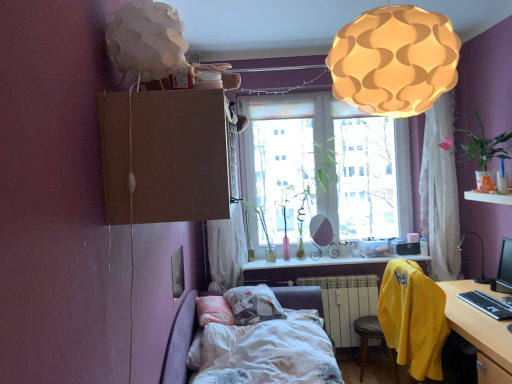
Image resolution: width=512 pixels, height=384 pixels. Describe the element at coordinates (481, 258) in the screenshot. I see `black plastic table lamp at right` at that location.

The image size is (512, 384). I want to click on translucent glass vase at window, the 4th plant from the front, so click(285, 217).

Locate an element on the screen. white sheer curtain at upper center, which is counted as the first curtain, starting from the left is located at coordinates (228, 229).

Describe the element at coordinates (146, 39) in the screenshot. I see `white paper lampshade at upper left, arranged as the 2th lamp when viewed from the right` at that location.

This screenshot has width=512, height=384. I want to click on translucent glass window at center, so click(x=326, y=167).

Image resolution: width=512 pixels, height=384 pixels. In order to click on black plastic table lamp at right in this screenshot , I will do `click(481, 258)`.

From a real-world perspective, is green glass vase at window, the 3th plant from the back, on top of black plastic keyboard at lower right?

Correct, in the physical world, green glass vase at window, the 3th plant from the back, is higher than black plastic keyboard at lower right.

Does green glass vase at window, arranged as the 2th plant when viewed from the front, turn towards black plastic keyboard at lower right?

No.

Measure the distance from green glass vase at window, arranged as the 2th plant when viewed from the front, to black plastic keyboard at lower right.

green glass vase at window, arranged as the 2th plant when viewed from the front, and black plastic keyboard at lower right are 1.35 meters apart from each other.

This screenshot has width=512, height=384. I want to click on desktop lying in front of the green glass vase at window, arranged as the 2th plant when viewed from the front, so click(487, 305).

Is point (362, 372) farther from camera compared to point (423, 167)?

That is False.

Is yellow fabric chair at lower right, acting as the 1th chair starting from the back, bigger or smaller than white sheer curtain at upper right, which appears as the 1th curtain when viewed from the right?

Clearly, yellow fabric chair at lower right, acting as the 1th chair starting from the back, is smaller in size than white sheer curtain at upper right, which appears as the 1th curtain when viewed from the right.

How many degrees apart are the facing directions of yellow fabric chair at lower right, acting as the 1th chair starting from the back, and white sheer curtain at upper right, which appears as the 1th curtain when viewed from the right?

They differ by 1.31 degrees in their facing directions.

Is yellow fabric chair at lower right, the 2th chair when ordered from top to bottom, in front of or behind white sheer curtain at upper right, positioned as the second curtain in left-to-right order, in the image?

yellow fabric chair at lower right, the 2th chair when ordered from top to bottom, is in front of white sheer curtain at upper right, positioned as the second curtain in left-to-right order.

Is green glass vase at window, which is the 2th plant from right to left, to the left or to the right of white sheer curtain at upper right, positioned as the second curtain in left-to-right order, in the image?

green glass vase at window, which is the 2th plant from right to left, is to the left of white sheer curtain at upper right, positioned as the second curtain in left-to-right order.

From a real-world perspective, does green glass vase at window, arranged as the 2th plant when viewed from the front, sit lower than white sheer curtain at upper right, positioned as the second curtain in left-to-right order?

Yes.

Based on the photo, from the image's perspective, is green glass vase at window, which is the 2th plant from right to left, beneath white sheer curtain at upper right, which appears as the 1th curtain when viewed from the right?

Correct, green glass vase at window, which is the 2th plant from right to left, appears lower than white sheer curtain at upper right, which appears as the 1th curtain when viewed from the right, in the image.

Is white sheer curtain at upper right, which appears as the 1th curtain when viewed from the right, a part of green glass vase at window, which is the 2th plant from right to left?

No, white sheer curtain at upper right, which appears as the 1th curtain when viewed from the right, is not a part of green glass vase at window, which is the 2th plant from right to left.

From a real-world perspective, is wooden desk at lower right positioned over white sheer curtain at upper right, positioned as the second curtain in left-to-right order, based on gravity?

Incorrect, from a real-world perspective, wooden desk at lower right is lower than white sheer curtain at upper right, positioned as the second curtain in left-to-right order.

Which point is more forward, (x=472, y=315) or (x=434, y=203)?

Point (x=472, y=315)

Which object is thinner, wooden desk at lower right or white sheer curtain at upper right, positioned as the second curtain in left-to-right order?

Thinner between the two is white sheer curtain at upper right, positioned as the second curtain in left-to-right order.

Would you say wooden desk at lower right is inside or outside white sheer curtain at upper right, which appears as the 1th curtain when viewed from the right?

wooden desk at lower right is outside white sheer curtain at upper right, which appears as the 1th curtain when viewed from the right.

Is white cotton bed at center aimed at black glossy monitor at right?

No, white cotton bed at center is not aimed at black glossy monitor at right.

From the image's perspective, which one is positioned lower, white cotton bed at center or black glossy monitor at right?

From the image's view, white cotton bed at center is below.

Considering the positions of point (280, 368) and point (498, 284), is point (280, 368) closer or farther from the camera than point (498, 284)?

Point (280, 368) is closer to the camera than point (498, 284).

From a real-world perspective, which object stands above the other?

matte white lampshade at upper center, which is the first lamp from back to front, from a real-world perspective.

Is yellow fabric chair at lower right, marked as the 1th chair in a bottom-to-top arrangement, positioned beyond the bounds of matte white lampshade at upper center, the 2th lamp from the front?

yellow fabric chair at lower right, marked as the 1th chair in a bottom-to-top arrangement, is positioned outside matte white lampshade at upper center, the 2th lamp from the front.

Considering the positions of objects yellow fabric chair at lower right, marked as the 1th chair in a bottom-to-top arrangement, and matte white lampshade at upper center, the 2th lamp from the front, in the image provided, who is more to the right, yellow fabric chair at lower right, marked as the 1th chair in a bottom-to-top arrangement, or matte white lampshade at upper center, the 2th lamp from the front,?

yellow fabric chair at lower right, marked as the 1th chair in a bottom-to-top arrangement, is more to the right.

Based on their sizes in the image, would you say yellow fabric chair at lower right, acting as the 1th chair starting from the back, is bigger or smaller than matte white lampshade at upper center, the 2th lamp from the front?

Clearly, yellow fabric chair at lower right, acting as the 1th chair starting from the back, is smaller in size than matte white lampshade at upper center, the 2th lamp from the front.

Who is more distant, white sheer curtain at upper center, which is counted as the first curtain, starting from the left, or translucent glass vase at window, the second plant when ordered from left to right?

Positioned behind is translucent glass vase at window, the second plant when ordered from left to right.

Which is correct: white sheer curtain at upper center, which is counted as the first curtain, starting from the left, is inside translucent glass vase at window, the second plant when ordered from left to right, or outside of it?

white sheer curtain at upper center, which is counted as the first curtain, starting from the left, is outside translucent glass vase at window, the second plant when ordered from left to right.

From the image's perspective, which one is positioned lower, white sheer curtain at upper center, which is counted as the first curtain, starting from the left, or translucent glass vase at window, marked as the first plant in a back-to-front arrangement?

translucent glass vase at window, marked as the first plant in a back-to-front arrangement, is shown below in the image.

Is white sheer curtain at upper center, the second curtain when ordered from right to left, oriented towards translucent glass vase at window, the second plant when ordered from left to right?

No, white sheer curtain at upper center, the second curtain when ordered from right to left, is not oriented towards translucent glass vase at window, the second plant when ordered from left to right.

At what (x,y) coordinates should I click in order to perform the action: click on desktop on the right of green glass vase at window, arranged as the 2th plant when viewed from the front. Please return your answer as a coordinate pair (x, y). The image size is (512, 384). Looking at the image, I should click on (487, 305).

You are a GUI agent. You are given a task and a screenshot of the screen. Output one action in this format:
    pyautogui.click(x=<x>, y=<y>)
    Task: Click on the chair that is the 2nd one below the white sheer curtain at upper right, positioned as the second curtain in left-to-right order (from a real-world perspective)
    This screenshot has width=512, height=384.
    Given the screenshot: What is the action you would take?
    pyautogui.click(x=366, y=337)

When comparing their distances from black plastic keyboard at lower right, does black plastic table lamp at right or matte white lampshade at upper center, positioned as the 1th lamp in right-to-left order, seem closer?

Based on the image, black plastic table lamp at right appears to be nearer to black plastic keyboard at lower right.

From the picture: Considering their positions, is black plastic table lamp at right positioned further to green glass vase at window, arranged as the 2th plant when viewed from the back, than black glossy monitor at right?

black glossy monitor at right is positioned further to the anchor green glass vase at window, arranged as the 2th plant when viewed from the back.

When comparing their distances from yellow fabric chair at lower right, marked as the 1th chair in a bottom-to-top arrangement, does matte white lampshade at upper center, which is the first lamp from back to front, or white painted metal radiator at lower center seem further?

The object further to yellow fabric chair at lower right, marked as the 1th chair in a bottom-to-top arrangement, is matte white lampshade at upper center, which is the first lamp from back to front.

When comparing their distances from black glossy monitor at right, does translucent glass window at center or white sheer curtain at upper center, the second curtain when ordered from right to left, seem further?

white sheer curtain at upper center, the second curtain when ordered from right to left, is positioned further to the anchor black glossy monitor at right.

When comparing their distances from black plastic keyboard at lower right, does black plastic table lamp at right or green glass vase at window, arranged as the 2th plant when viewed from the front, seem closer?

Among the two, black plastic table lamp at right is located nearer to black plastic keyboard at lower right.

When comparing their distances from matte white lampshade at upper center, acting as the 2th lamp starting from the left, does white paper lampshade at upper left, the first lamp in the left-to-right sequence, or translucent glass vase at window, the third plant viewed from the right, seem further?

Based on the image, translucent glass vase at window, the third plant viewed from the right, appears to be further to matte white lampshade at upper center, acting as the 2th lamp starting from the left.

Estimate the real-world distances between objects in this image. Which object is closer to black plastic table lamp at right, white sheer curtain at upper right, positioned as the second curtain in left-to-right order, or clear glass vase at center, which is the first window sill in bottom-to-top order?

white sheer curtain at upper right, positioned as the second curtain in left-to-right order, is closer to black plastic table lamp at right.

When comparing their distances from green glass vase at window, placed as the 1th plant when sorted from left to right, does clear glass vase at center, acting as the 1th window sill starting from the right, or white sheer curtain at upper right, which appears as the 1th curtain when viewed from the right, seem closer?

Based on the image, white sheer curtain at upper right, which appears as the 1th curtain when viewed from the right, appears to be nearer to green glass vase at window, placed as the 1th plant when sorted from left to right.

Identify the location of table lamp that lies between translucent glass window at center and white painted metal radiator at lower center from top to bottom. (481, 258).

Locate an element on the screen. desktop between green leafy plant at upper right, marked as the fourth plant in a back-to-front arrangement, and yellow fabric chair at lower right, marked as the first chair in a front-to-back arrangement, vertically is located at coordinates (487, 305).

Identify the location of window between green leafy plant at upper right, arranged as the first plant when viewed from the front, and yellow fabric chair at lower right, marked as the 1th chair in a bottom-to-top arrangement, from top to bottom. (326, 167).

This screenshot has height=384, width=512. I want to click on table lamp between green glass vase at window, which is the 2th plant from right to left, and yellow fabric chair at lower right, acting as the 1th chair starting from the back, from top to bottom, so click(x=481, y=258).